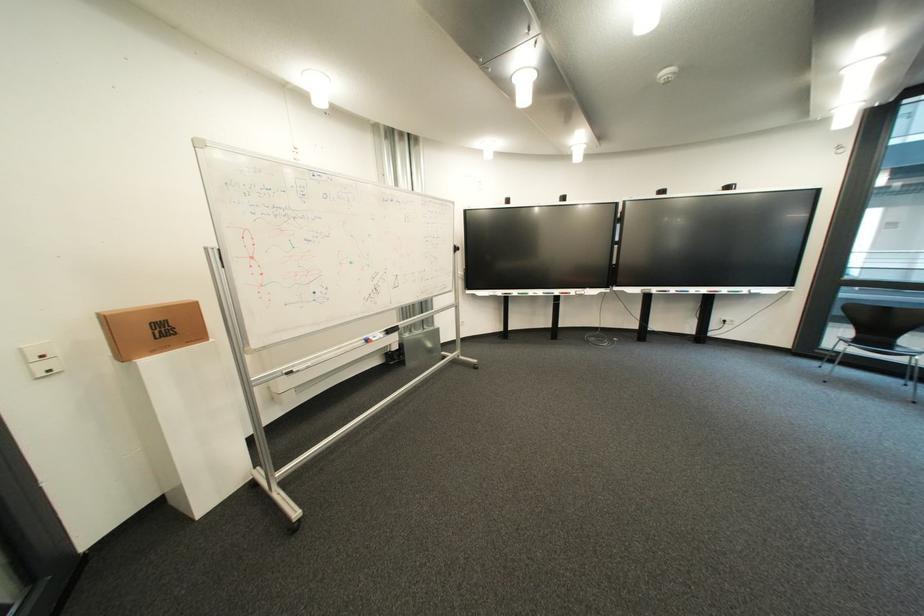
The image size is (924, 616). I want to click on blue whiteboard marker, so click(788, 294).